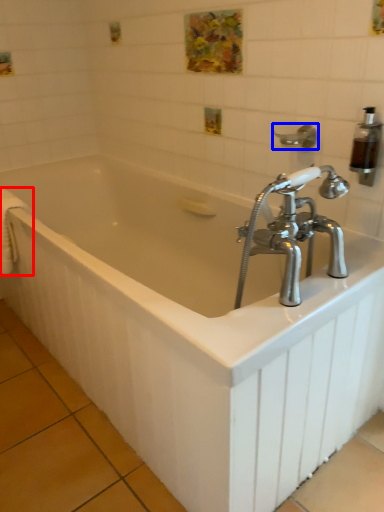
Question: Among these objects, which one is nearest to the camera, towel bar (highlighted by a red box) or shower (highlighted by a blue box)?

Choices:
 (A) towel bar
 (B) shower

Answer: (B)